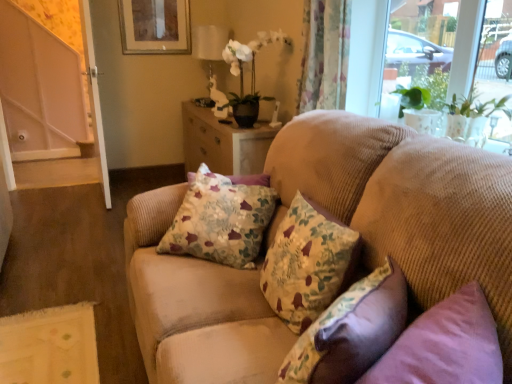
Question: From a real-world perspective, does floral fabric pillow at center, the third pillow viewed from the back, sit lower than white glossy lampshade at upper center?

Choices:
 (A) no
 (B) yes

Answer: (B)

Question: From the image's perspective, is floral fabric pillow at center, which is the 1th pillow in front-to-back order, on top of white glossy lampshade at upper center?

Choices:
 (A) no
 (B) yes

Answer: (A)

Question: Does floral fabric pillow at center, the third pillow viewed from the back, come in front of white glossy lampshade at upper center?

Choices:
 (A) no
 (B) yes

Answer: (B)

Question: Is white glossy lampshade at upper center a part of floral fabric pillow at center, which is the 1th pillow in front-to-back order?

Choices:
 (A) no
 (B) yes

Answer: (A)

Question: Is floral fabric pillow at center, the third pillow viewed from the back, completely or partially outside of white glossy lampshade at upper center?

Choices:
 (A) no
 (B) yes

Answer: (B)

Question: Is floral fabric pillow at center, the third pillow viewed from the back, further to the viewer compared to white glossy lampshade at upper center?

Choices:
 (A) yes
 (B) no

Answer: (B)

Question: Is white glossy lampshade at upper center located within beige corduroy couch at center?

Choices:
 (A) no
 (B) yes

Answer: (A)

Question: From the image's perspective, is beige corduroy couch at center on white glossy lampshade at upper center?

Choices:
 (A) no
 (B) yes

Answer: (A)

Question: Could you tell me if beige corduroy couch at center is facing white glossy lampshade at upper center?

Choices:
 (A) yes
 (B) no

Answer: (B)

Question: Is beige corduroy couch at center outside of white glossy lampshade at upper center?

Choices:
 (A) no
 (B) yes

Answer: (B)

Question: Is beige corduroy couch at center smaller than white glossy lampshade at upper center?

Choices:
 (A) no
 (B) yes

Answer: (A)

Question: Is beige corduroy couch at center shorter than white glossy lampshade at upper center?

Choices:
 (A) yes
 (B) no

Answer: (B)

Question: From a real-world perspective, does floral fabric cushion at center, the first pillow positioned from the back, sit lower than beige corduroy couch at center?

Choices:
 (A) yes
 (B) no

Answer: (B)